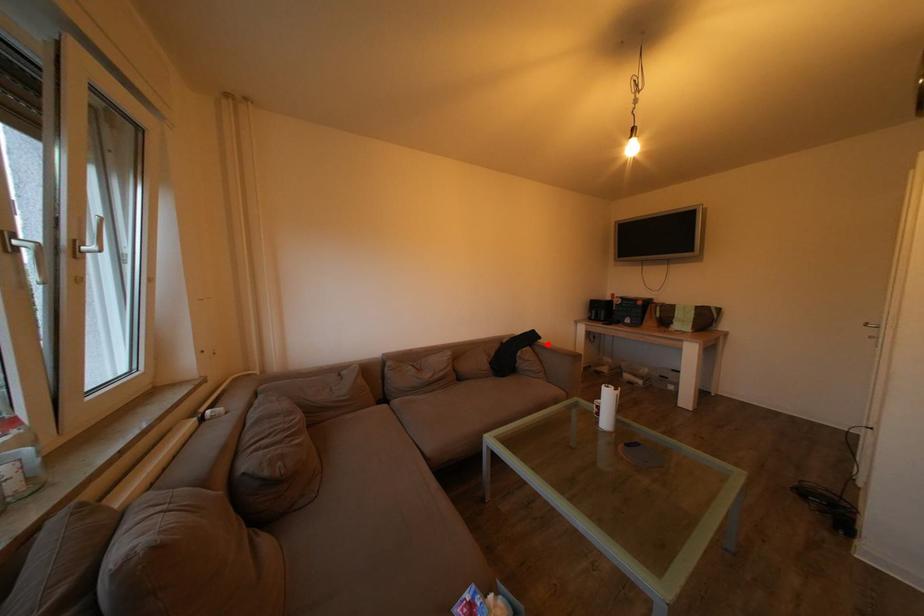
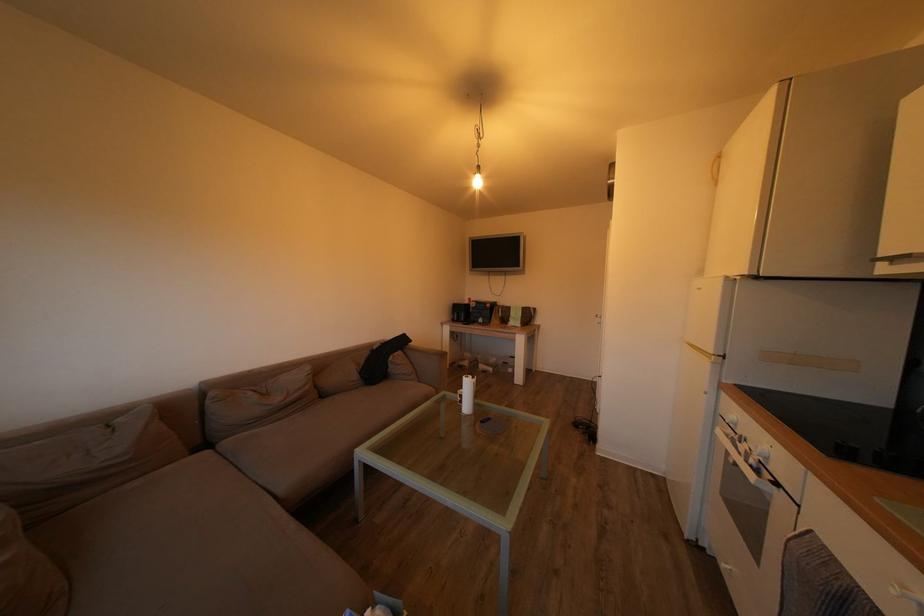
Question: I am providing you with two images of the same scene from different viewpoints. A red point is marked on the first image. At the location where the point appears in image 1, is it still visible in image 2?

Choices:
 (A) Yes
 (B) No

Answer: (A)